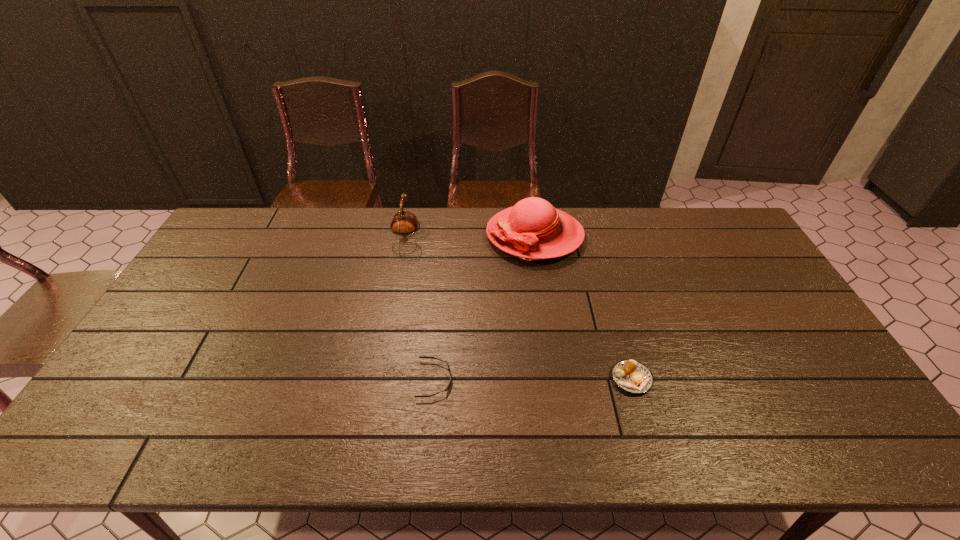
What are the coordinates of `free spot that satisfies the following two spatial constraints: 1. at the front of the hat with a bow; 2. on the right side of the pastry` in the screenshot? It's located at (555, 379).

Locate an element on the screen. Image resolution: width=960 pixels, height=540 pixels. vacant space that satisfies the following two spatial constraints: 1. at the front of the pastry with a bow; 2. on the left side of the tallest object is located at coordinates (555, 379).

Where is `free space that satisfies the following two spatial constraints: 1. on the back side of the third tallest object; 2. on the rotary dial of the telephone`? free space that satisfies the following two spatial constraints: 1. on the back side of the third tallest object; 2. on the rotary dial of the telephone is located at coordinates (590, 237).

This screenshot has height=540, width=960. In order to click on blank space that satisfies the following two spatial constraints: 1. on the back side of the second shortest object; 2. on the rotary dial of the second tallest object in this screenshot , I will do `click(590, 237)`.

Where is `vacant space that satisfies the following two spatial constraints: 1. at the front of the tallest object with a bow; 2. on the back side of the second shortest object`? vacant space that satisfies the following two spatial constraints: 1. at the front of the tallest object with a bow; 2. on the back side of the second shortest object is located at coordinates (555, 379).

Image resolution: width=960 pixels, height=540 pixels. In order to click on vacant area in the image that satisfies the following two spatial constraints: 1. on the rotary dial of the telephone; 2. on the back side of the third tallest object in this screenshot , I will do (382, 379).

This screenshot has width=960, height=540. Find the location of `vacant space that satisfies the following two spatial constraints: 1. at the front of the pastry with a bow; 2. on the right side of the tallest object`. vacant space that satisfies the following two spatial constraints: 1. at the front of the pastry with a bow; 2. on the right side of the tallest object is located at coordinates (555, 379).